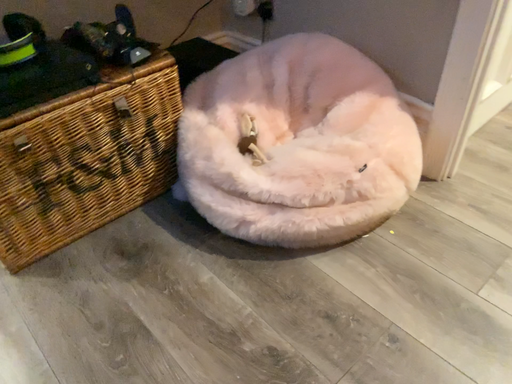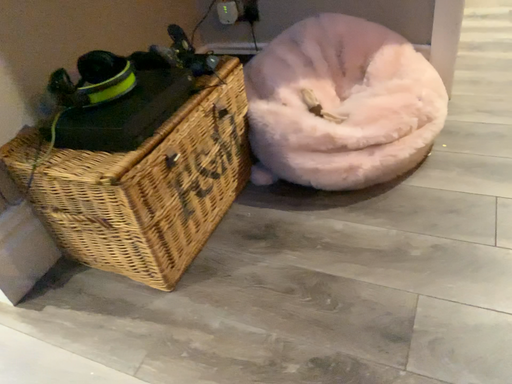
Question: Which way did the camera rotate in the video?

Choices:
 (A) rotated right
 (B) rotated left

Answer: (A)